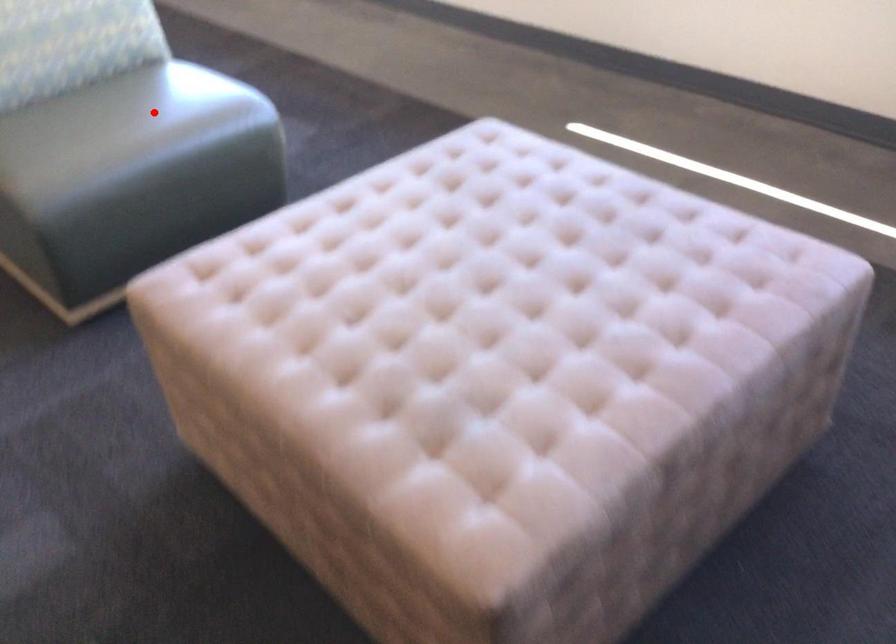
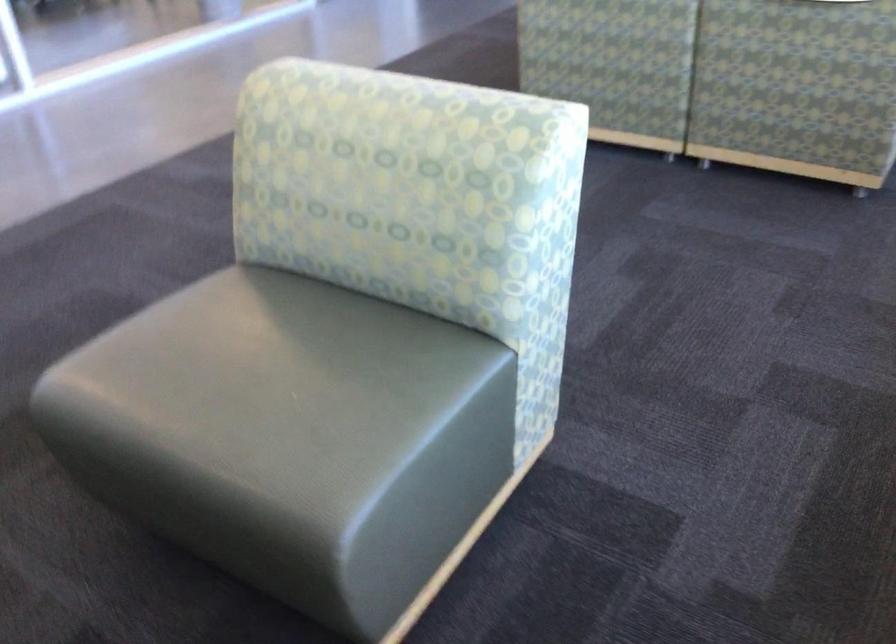
Question: I am providing you with two images of the same scene from different viewpoints. A red point is shown in image1. For the corresponding object point in image2, is it positioned nearer or farther from the camera?

Choices:
 (A) Nearer
 (B) Farther

Answer: (A)